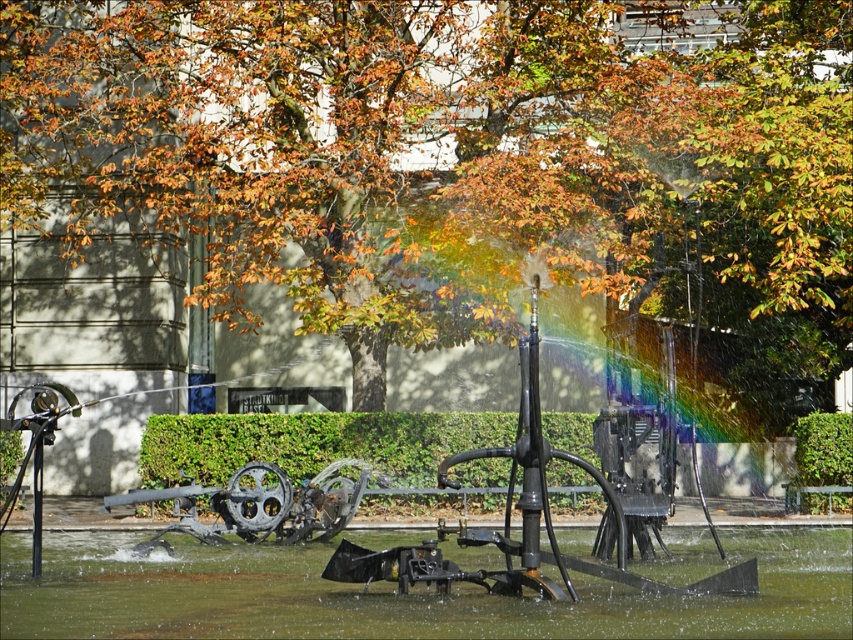
You are a landscape architect designing a new garden path that needs to pass between the greenish water at center and the green hedge at center. Given that the path must be at least 2 meters wide to accommodate wheelchairs, can the existing space between them accommodate this requirement?

The greenish water at center is wider than the green hedge at center. However, the description only states their relative widths, not the exact distance between them. Without knowing the actual spacing between the two objects, it is impossible to determine if the 2 meter path requirement can be met.

You are standing at the center of the park and want to pick up autumn leaves at center. Which direction should you move to reach them?

Since the autumn leaves at center are located at point coordinates of 0.245 on the x axis and 0.531 on the y axis, you should move towards the center of the park to reach them.

You are a photographer aiming to capture the autumn leaves at center and greenish water at center in the same frame. Which object will occupy more space in your photo?

The autumn leaves at center is larger in size than greenish water at center, so it will occupy more space in the photo.